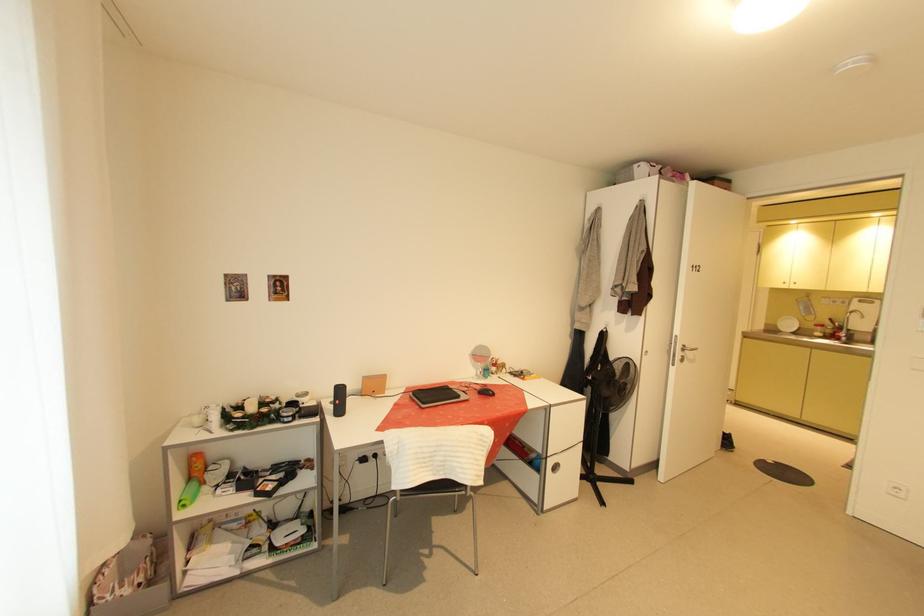
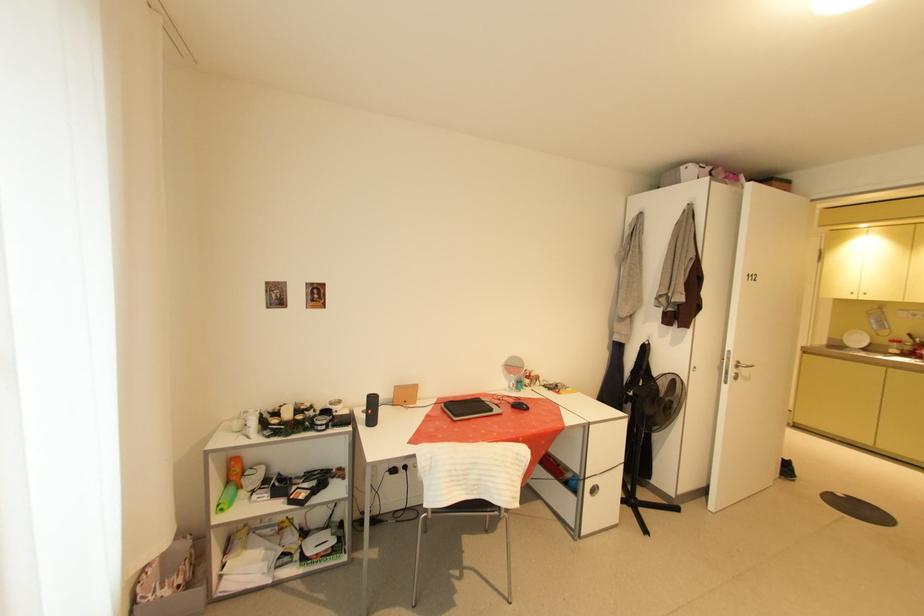
Question: The first image is from the beginning of the video and the second image is from the end. How did the camera likely rotate when shooting the video?

Choices:
 (A) Left
 (B) Right
 (C) Up
 (D) Down

Answer: (A)